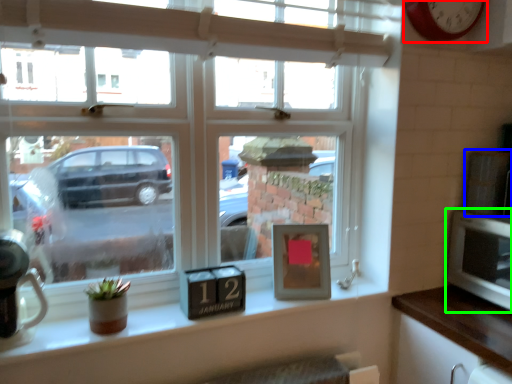
Question: Which object is positioned closest to clock (highlighted by a red box)? Select from appliance (highlighted by a blue box) and microwave (highlighted by a green box).

Choices:
 (A) appliance
 (B) microwave

Answer: (A)